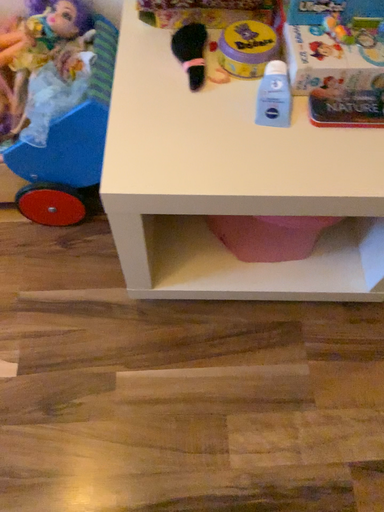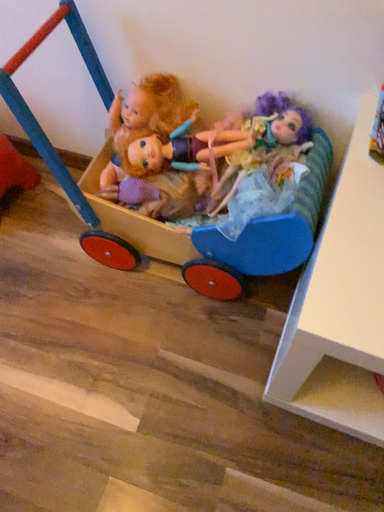
Question: Which way did the camera rotate in the video?

Choices:
 (A) rotated downward
 (B) rotated upward

Answer: (B)